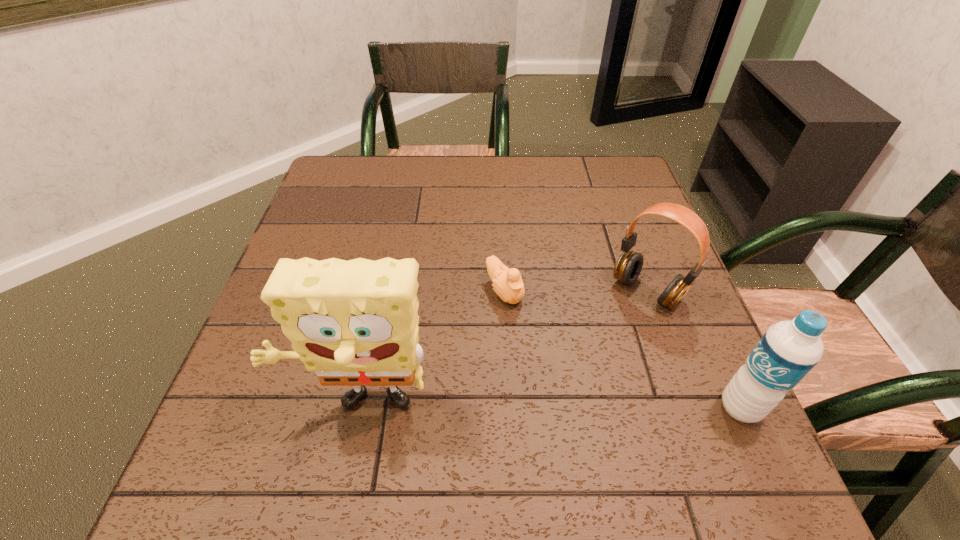
Image resolution: width=960 pixels, height=540 pixels. In order to click on the leftmost object in this screenshot , I will do `click(355, 323)`.

You are a GUI agent. You are given a task and a screenshot of the screen. Output one action in this format:
    pyautogui.click(x=<x>, y=<y>)
    Task: Click on the sponge
    
    Given the screenshot: What is the action you would take?
    pyautogui.click(x=355, y=323)

Find the location of a particular element. The height and width of the screenshot is (540, 960). water bottle is located at coordinates (786, 353).

Identify the location of the shortest object. This screenshot has width=960, height=540. (508, 285).

The image size is (960, 540). I want to click on duckling, so tap(508, 285).

Locate an element on the screen. The image size is (960, 540). the second shortest object is located at coordinates (628, 266).

Identify the location of vacant space located 0.190m on the label of the water bottle. (612, 408).

Identify the location of free space located on the label of the water bottle. (596, 408).

The image size is (960, 540). I want to click on vacant position located 0.180m on the label of the water bottle, so click(x=618, y=408).

Identify the location of vacant space situated 0.070m on the face of the third object from right to left. [533, 331].